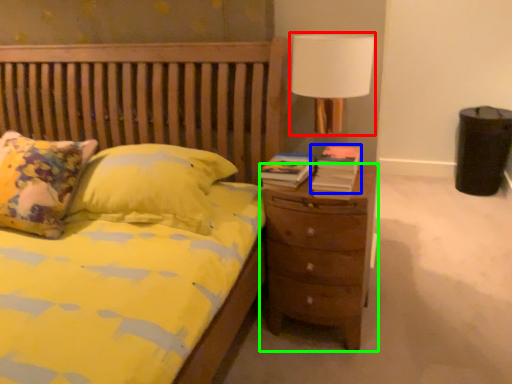
Question: Estimate the real-world distances between objects in this image. Which object is closer to lamp (highlighted by a red box), book (highlighted by a blue box) or nightstand (highlighted by a green box)?

Choices:
 (A) book
 (B) nightstand

Answer: (A)